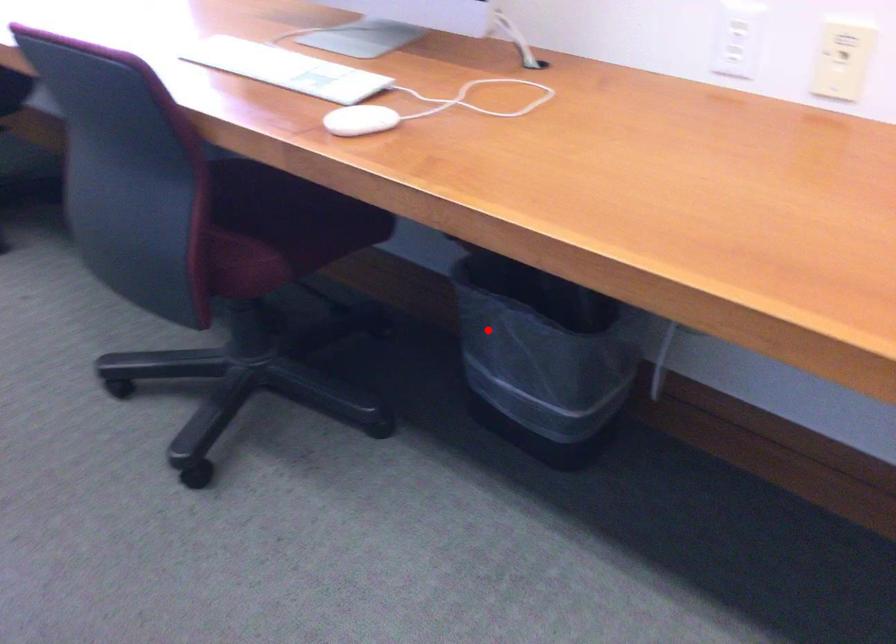
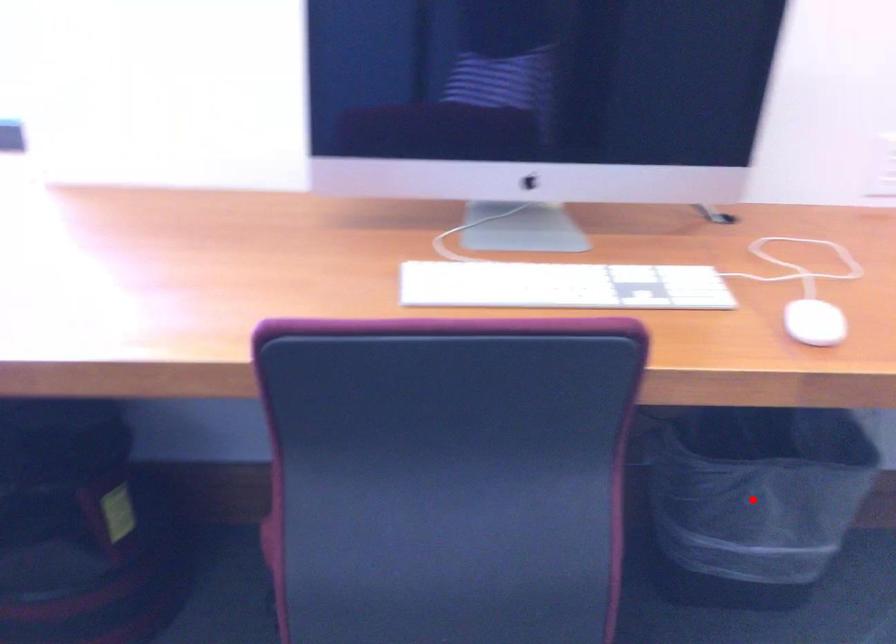
From the picture: I am providing you with two images of the same scene from different viewpoints. A red point is marked on the first image and another point is marked on the second image. Are the points marked in image1 and image2 representing the same 3D position?

Yes